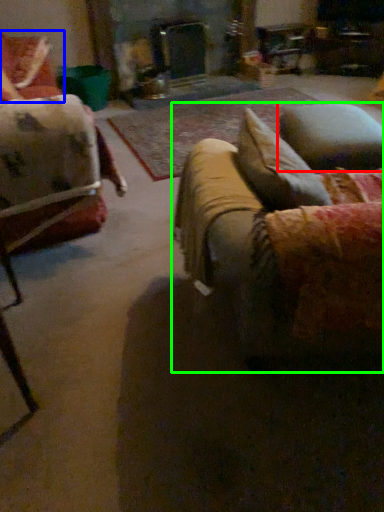
Question: Considering the real-world distances, which object is farthest from pillow (highlighted by a red box)? chair (highlighted by a blue box) or studio couch (highlighted by a green box)?

Choices:
 (A) chair
 (B) studio couch

Answer: (A)